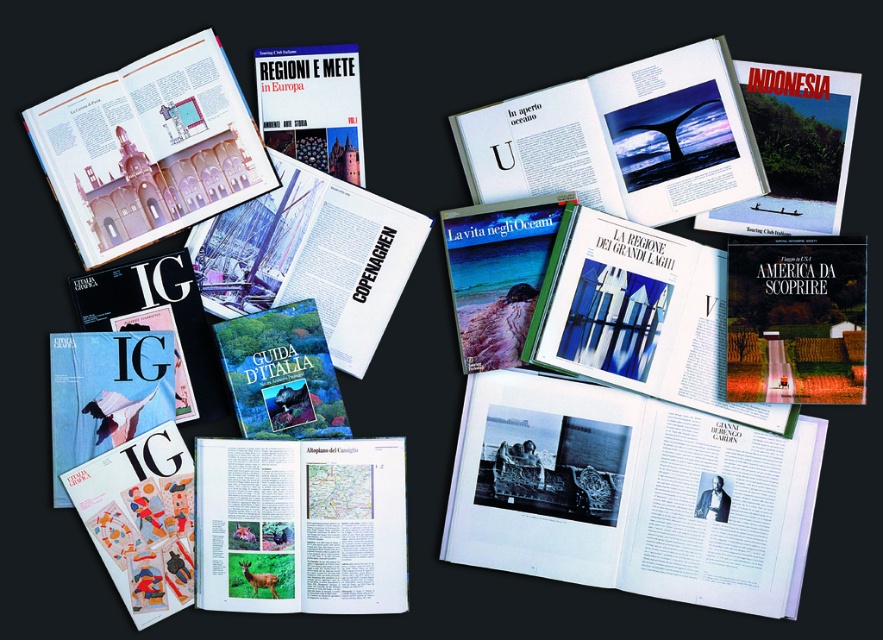
Question: Which point is closer to the camera?

Choices:
 (A) (738, 433)
 (B) (391, 548)

Answer: (B)

Question: Which point appears farthest from the camera in this image?

Choices:
 (A) (240, 189)
 (B) (592, 484)
 (C) (614, 99)

Answer: (B)

Question: Is black glossy book at center closer to the viewer compared to matte pink building at upper left?

Choices:
 (A) yes
 (B) no

Answer: (A)

Question: Is black glossy book at center below matte blue whale tail at upper center?

Choices:
 (A) yes
 (B) no

Answer: (A)

Question: Is matte blue whale tail at upper center smaller than matte paper guide at center?

Choices:
 (A) yes
 (B) no

Answer: (B)

Question: Which object is farther from the camera taking this photo?

Choices:
 (A) matte pink building at upper left
 (B) matte paper guide at center

Answer: (A)